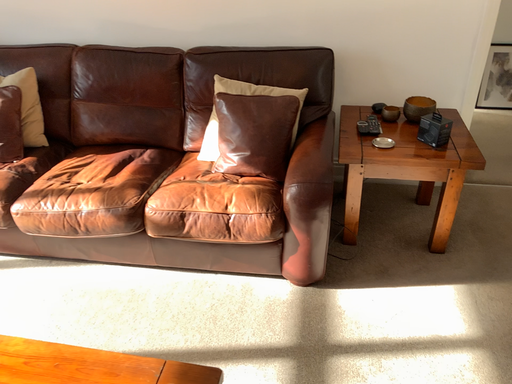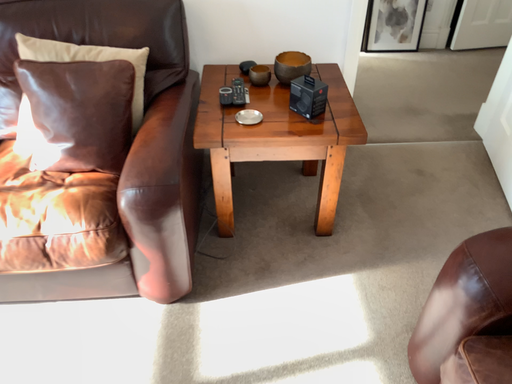
Question: Which way did the camera rotate in the video?

Choices:
 (A) rotated right
 (B) rotated left

Answer: (A)